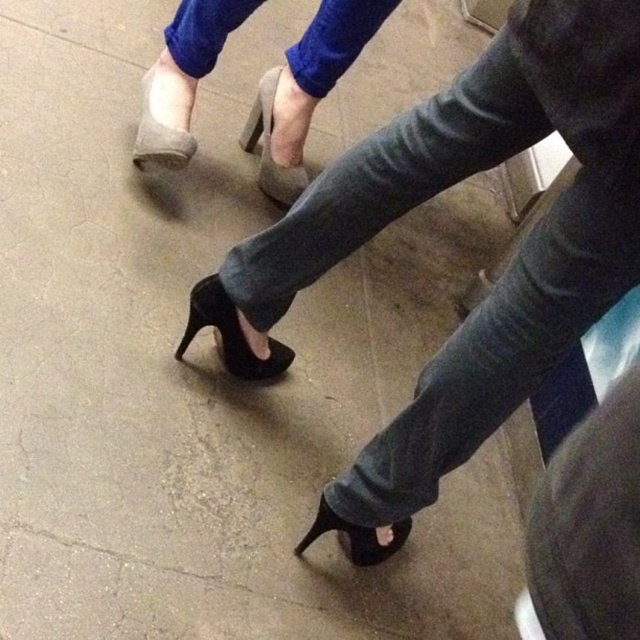
Question: Which point is closer to the camera?

Choices:
 (A) (518, 324)
 (B) (368, 564)

Answer: (A)

Question: Which object is positioned farthest from the suede-like beige high-heeled shoe at center?

Choices:
 (A) black leather high-heeled shoe at center
 (B) suede high-heeled shoes at upper center
 (C) black denim jeans at center

Answer: (C)

Question: Is black denim jeans at center smaller than suede-like beige high-heeled shoe at center?

Choices:
 (A) no
 (B) yes

Answer: (A)

Question: Is black leather high-heeled shoe at center behind black leather high-heeled shoe at lower center?

Choices:
 (A) yes
 (B) no

Answer: (A)

Question: Where is matte gray high-heeled shoe at upper left located in relation to black leather high-heeled shoe at center in the image?

Choices:
 (A) above
 (B) below

Answer: (A)

Question: Which object is farther from the camera taking this photo?

Choices:
 (A) matte gray high-heeled shoe at upper left
 (B) suede-like beige high-heeled shoe at center
 (C) blue denim jeans at upper center
 (D) black denim jeans at center

Answer: (B)